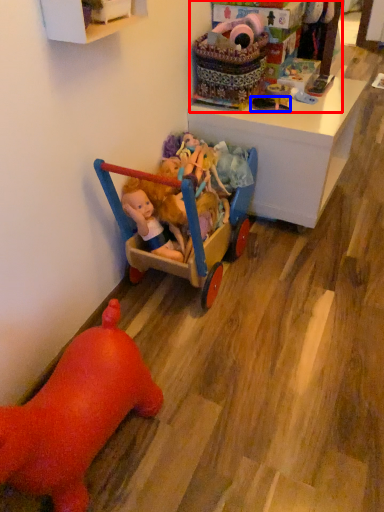
Question: Which of the following is the farthest to the observer, toyshop (highlighted by a red box) or toy (highlighted by a blue box)?

Choices:
 (A) toyshop
 (B) toy

Answer: (B)